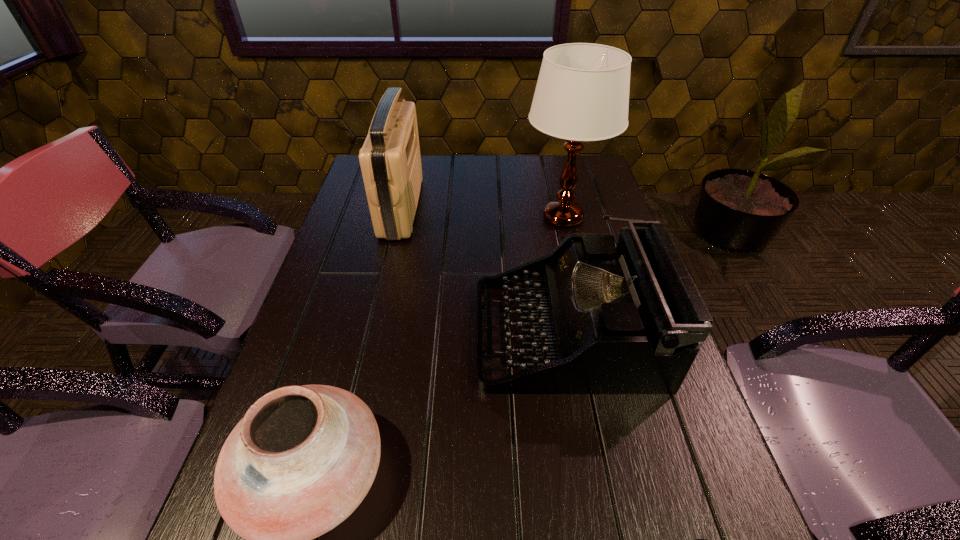
You are a GUI agent. You are given a task and a screenshot of the screen. Output one action in this format:
    pyautogui.click(x=<x>, y=<y>)
    Task: Click on the table lamp present at the right edge
    The width and height of the screenshot is (960, 540).
    Given the screenshot: What is the action you would take?
    pyautogui.click(x=582, y=94)

Where is `typewriter that is positioned at the right edge`? typewriter that is positioned at the right edge is located at coordinates (628, 319).

Identify the location of object situated at the far left corner. This screenshot has width=960, height=540. (390, 160).

The image size is (960, 540). I want to click on vacant space at the left edge of the desktop, so click(362, 200).

Locate an element on the screen. This screenshot has height=540, width=960. free space at the right edge of the desktop is located at coordinates pyautogui.click(x=672, y=429).

Locate an element on the screen. vacant area at the far right corner is located at coordinates click(x=603, y=192).

Locate an element on the screen. The height and width of the screenshot is (540, 960). free space between the fourth shortest object and the typewriter is located at coordinates (484, 270).

At what (x,y) coordinates should I click in order to perform the action: click on object that is the fourth closest to the shortest object. Please return your answer as a coordinate pair (x, y). Image resolution: width=960 pixels, height=540 pixels. Looking at the image, I should click on (x=390, y=160).

Identify which object is the second nearest to the shortest object. Please provide its 2D coordinates. Your answer should be formatted as a tuple, i.e. [(x, y)], where the tuple contains the x and y coordinates of a point satisfying the conditions above.

[(301, 460)]

At what (x,y) coordinates should I click in order to perform the action: click on free spot that satisfies the following two spatial constraints: 1. on the front-facing side of the second tallest object; 2. on the back side of the table lamp. Please return your answer as a coordinate pair (x, y). This screenshot has height=540, width=960. Looking at the image, I should click on (398, 217).